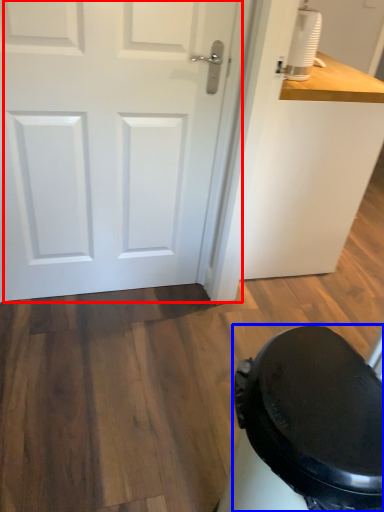
Question: Which object appears farthest to the camera in this image, door (highlighted by a red box) or potty (highlighted by a blue box)?

Choices:
 (A) door
 (B) potty

Answer: (A)